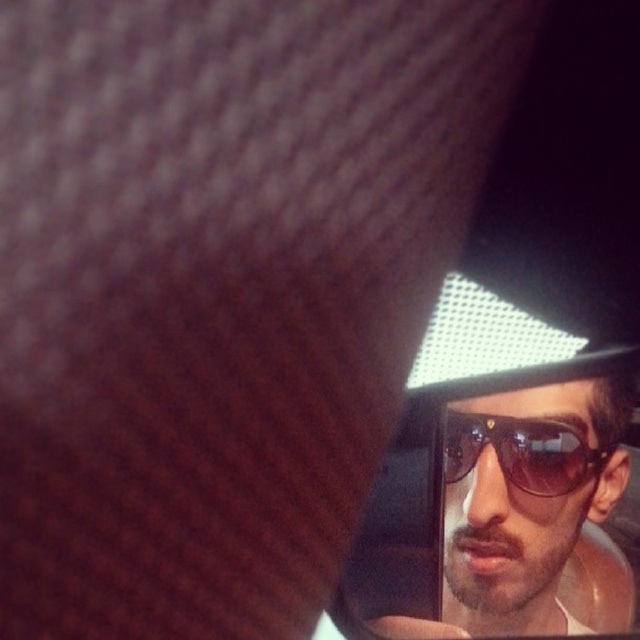
Question: Which of the following is the farthest from the observer?

Choices:
 (A) sunglasses at upper right
 (B) sunglasses at right

Answer: (B)

Question: Can you confirm if sunglasses at upper right is positioned to the left of sunglasses at right?

Choices:
 (A) yes
 (B) no

Answer: (B)

Question: Is sunglasses at upper right smaller than sunglasses at right?

Choices:
 (A) yes
 (B) no

Answer: (B)

Question: Does sunglasses at upper right appear on the left side of sunglasses at right?

Choices:
 (A) yes
 (B) no

Answer: (B)

Question: Which point appears farthest from the camera in this image?

Choices:
 (A) (628, 461)
 (B) (552, 481)

Answer: (A)